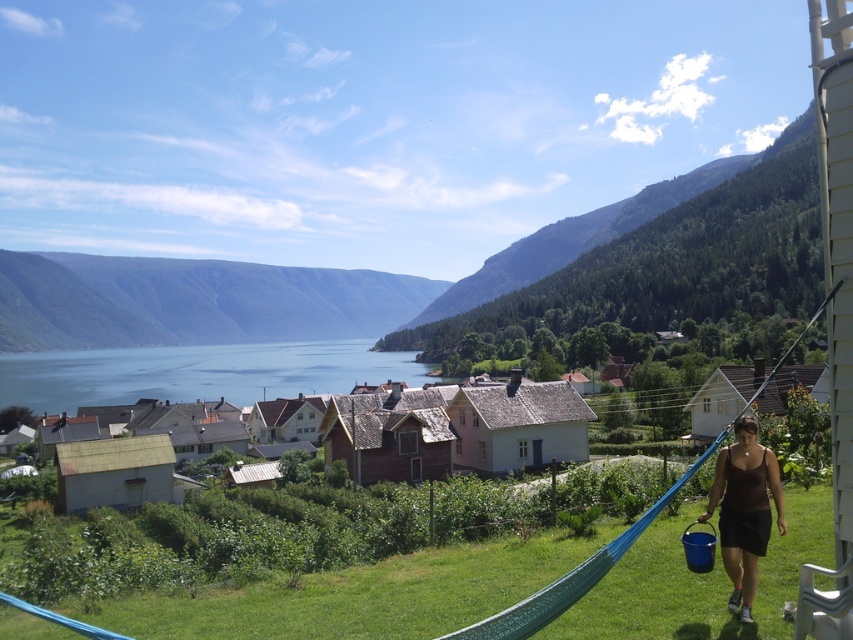
You are standing at the point labeled as point (296, 282) in the image. What can you see in the direction you are facing?

You can see the green forested mountain at upper center in the direction you are facing.

You are planning to take a photo of the green forested mountain at upper center and the blue water at center. Which object will occupy more space in the photo frame?

The green forested mountain at upper center will occupy more space in the photo frame because its width is larger than the blue water at center.